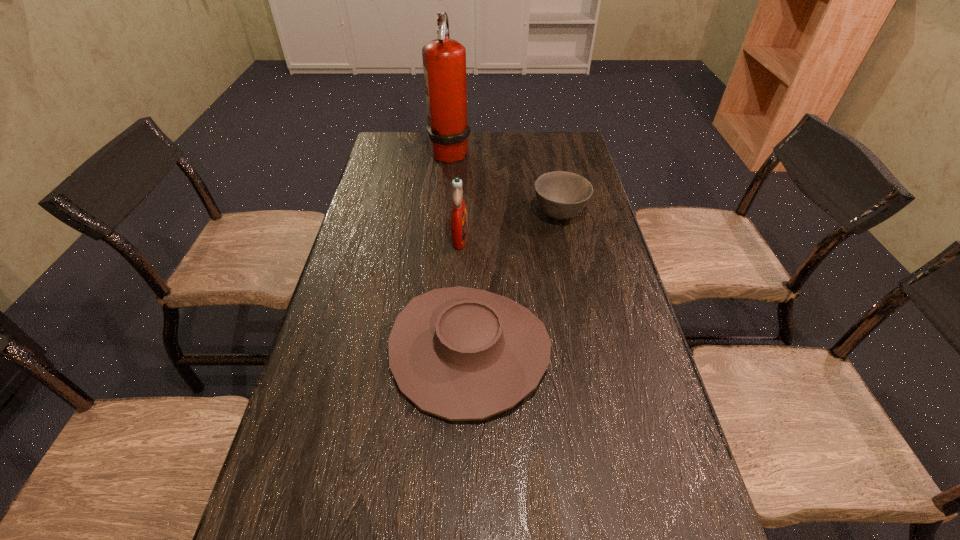
The image size is (960, 540). Find the location of `vacant area that lies between the rightmost object and the nearest object`. vacant area that lies between the rightmost object and the nearest object is located at coordinates (515, 282).

You are a GUI agent. You are given a task and a screenshot of the screen. Output one action in this format:
    pyautogui.click(x=<x>, y=<y>)
    Task: Click on the object that is the second nearest to the rightmost object
    
    Given the screenshot: What is the action you would take?
    pyautogui.click(x=459, y=353)

Find the location of a particular element. The width and height of the screenshot is (960, 540). object that stands as the closest to the cowboy hat is located at coordinates (458, 216).

You are a GUI agent. You are given a task and a screenshot of the screen. Output one action in this format:
    pyautogui.click(x=<x>, y=<y>)
    Task: Click on the free space that satisfies the following two spatial constraints: 1. at the nozzle of the nearest object; 2. on the left side of the fire extinguisher
    
    Given the screenshot: What is the action you would take?
    pyautogui.click(x=430, y=350)

Where is `vacant region that satisfies the following two spatial constraints: 1. at the nozzle of the rightmost object; 2. on the right side of the tallest object`? vacant region that satisfies the following two spatial constraints: 1. at the nozzle of the rightmost object; 2. on the right side of the tallest object is located at coordinates point(444,214).

Locate an element on the screen. blank space that satisfies the following two spatial constraints: 1. at the nozzle of the fire extinguisher; 2. on the right side of the cowboy hat is located at coordinates (430, 350).